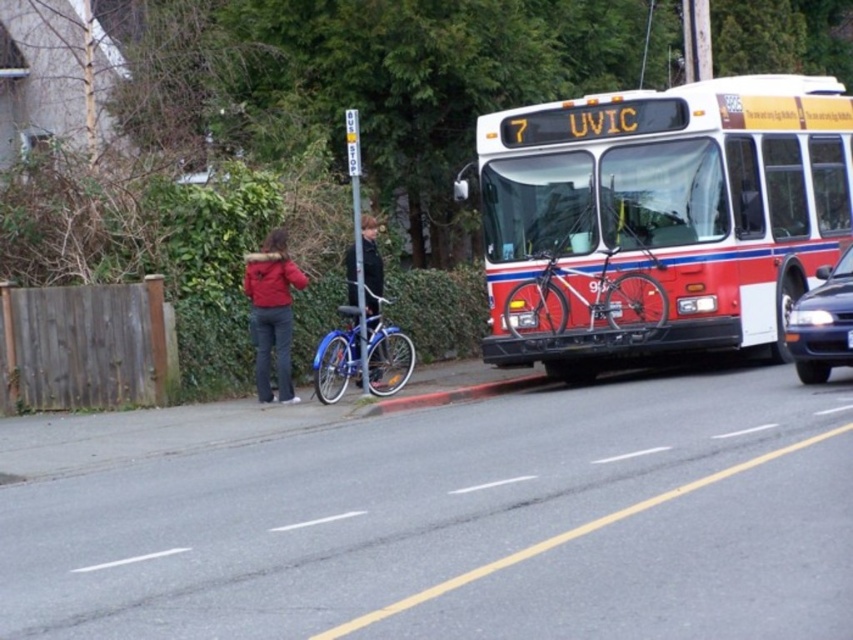
Which is in front, point (622, 326) or point (508, 385)?

Positioned in front is point (622, 326).

Does shiny metallic bicycle at center have a larger size compared to red painted concrete curb at lower center?

Correct, shiny metallic bicycle at center is larger in size than red painted concrete curb at lower center.

Does point (602, 307) come farther from viewer compared to point (547, 381)?

That is False.

Identify the location of shiny metallic bicycle at center. (585, 298).

At what (x,y) coordinates should I click in order to perform the action: click on red matte bus at upper right. Please return your answer as a coordinate pair (x, y). The image size is (853, 640). Looking at the image, I should click on (660, 218).

Is red matte bus at upper right below red painted concrete curb at lower center?

No.

Is point (519, 269) more distant than point (538, 372)?

No, it is in front of (538, 372).

You are a GUI agent. You are given a task and a screenshot of the screen. Output one action in this format:
    pyautogui.click(x=<x>, y=<y>)
    Task: Click on the red matte bus at upper right
    Image resolution: width=853 pixels, height=640 pixels.
    Given the screenshot: What is the action you would take?
    660,218

Is red matte bus at upper right wider than black plastic license plate at center?

Indeed, red matte bus at upper right has a greater width compared to black plastic license plate at center.

Which is more to the right, red matte bus at upper right or black plastic license plate at center?

From the viewer's perspective, black plastic license plate at center appears more on the right side.

Does point (701, 250) come closer to viewer compared to point (851, 339)?

No, (701, 250) is behind (851, 339).

Locate an element on the screen. This screenshot has width=853, height=640. red matte bus at upper right is located at coordinates (660, 218).